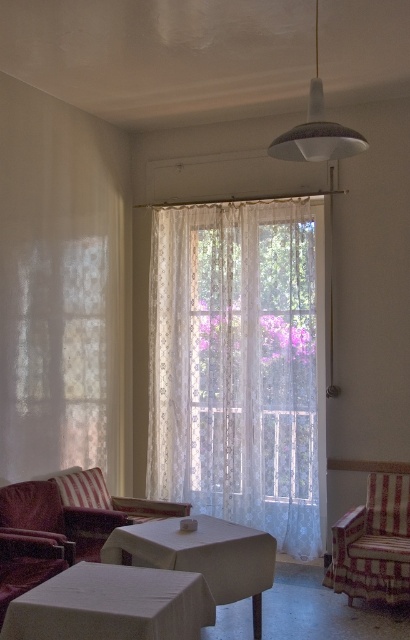
You are planning to place a large potted plant between the striped fabric armchair at lower right and the velvet red armchair at lower left. Considering their sizes, which armchair should the plant be closer to?

The striped fabric armchair at lower right is larger in size than the velvet red armchair at lower left, so the plant should be placed closer to the striped fabric armchair at lower right to balance the space.